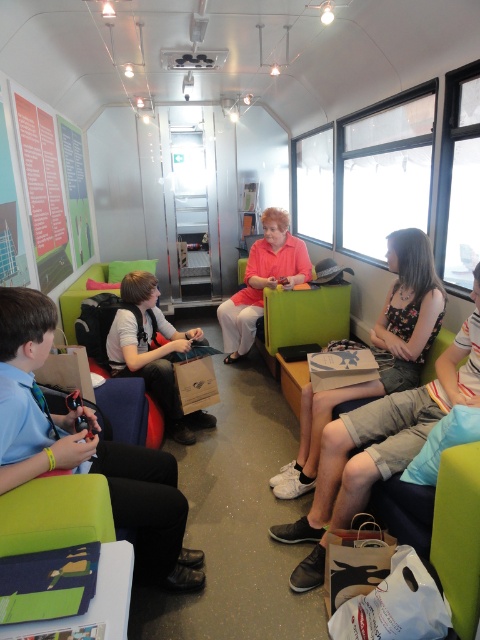
You are a delivery robot that needs to place a package between the matte brown paper bag at center and the matte orange shirt at center. The package is 1 meter long. Can you fit it between them?

The distance between the matte brown paper bag at center and the matte orange shirt at center is 98.42 centimeters, which is shorter than the 1 meter length of the package. Therefore, the package cannot be placed between them.

Based on the photo, you are a passenger on the train and need to know if you can place your new smartphone case, which is 2 cm thick, between the light blue shirt at left and the matte brown paper bag at center. Can you fit it there?

The light blue shirt at left is thinner than the matte brown paper bag at center. Since the smartphone case is 2 cm thick, it depends on the exact thickness of both items. However, since the shirt is thinner, there might be enough space if the combined thickness allows. Without specific measurements, it is uncertain.

You are a passenger on this train and you want to place your matte brown paper bag at center on top of your matte orange shirt at center. Is this possible based on their sizes?

The matte brown paper bag at center is smaller than the matte orange shirt at center, so it can be placed on top of it.